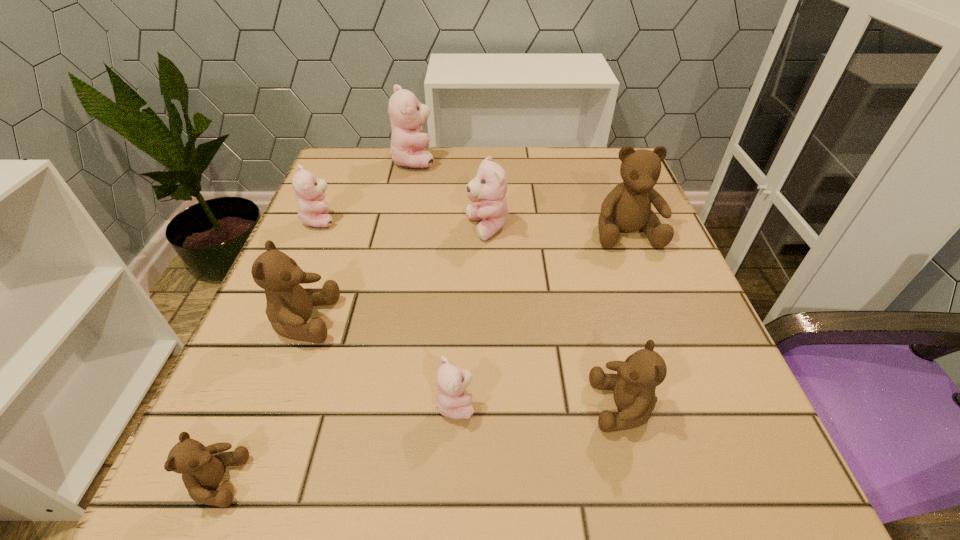
This screenshot has height=540, width=960. Identify the location of vacant region between the third smallest pink teddy bear and the smallest brown teddy bear. (352, 355).

This screenshot has height=540, width=960. In order to click on vacant space that is in between the farthest brown teddy bear and the fourth nearest teddy bear in this screenshot , I will do [465, 276].

Locate an element on the screen. The image size is (960, 540). vacant space that's between the farthest brown teddy bear and the third smallest pink teddy bear is located at coordinates (557, 230).

This screenshot has width=960, height=540. I want to click on object that is the seventh closest to the smallest pink teddy bear, so click(x=407, y=115).

Locate an element on the screen. The height and width of the screenshot is (540, 960). object that can be found as the sixth closest to the leftmost pink teddy bear is located at coordinates (627, 208).

Identify which teddy bear is the fourth nearest to the smallest pink teddy bear. Please provide its 2D coordinates. Your answer should be formatted as a tuple, i.e. [(x, y)], where the tuple contains the x and y coordinates of a point satisfying the conditions above.

[(489, 187)]

Identify the location of teddy bear that is the seventh nearest to the biggest brown teddy bear. (202, 468).

Identify the location of pink teddy bear that can be found as the fourth closest to the second smallest brown teddy bear. This screenshot has width=960, height=540. (407, 115).

At what (x,y) coordinates should I click in order to perform the action: click on the third closest pink teddy bear to the third nearest brown teddy bear. Please return your answer as a coordinate pair (x, y). This screenshot has width=960, height=540. Looking at the image, I should click on (489, 187).

Image resolution: width=960 pixels, height=540 pixels. I want to click on brown teddy bear identified as the closest to the biggest brown teddy bear, so click(634, 385).